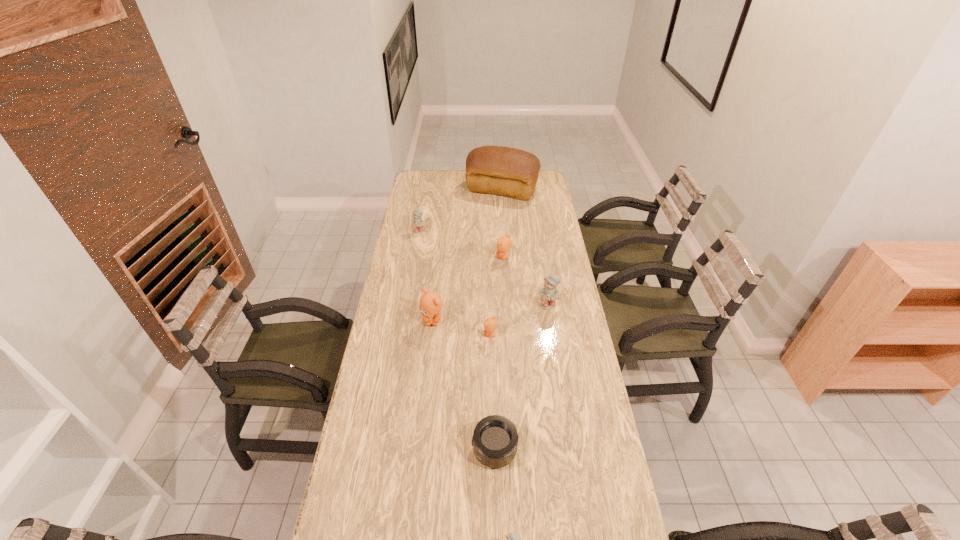
At what (x,y) coordinates should I click in order to perform the action: click on vacant position located on the face of the second brown teddy bear from left to right. Please return your answer as a coordinate pair (x, y). The width and height of the screenshot is (960, 540). Looking at the image, I should click on (444, 335).

Image resolution: width=960 pixels, height=540 pixels. Find the location of `free space located on the face of the second brown teddy bear from left to right`. free space located on the face of the second brown teddy bear from left to right is located at coordinates (427, 335).

Where is `vacant space located 0.340m on the face of the second brown teddy bear from left to right`? The height and width of the screenshot is (540, 960). vacant space located 0.340m on the face of the second brown teddy bear from left to right is located at coordinates click(392, 335).

Find the location of a particular element. vacant region located 0.240m on the side of the second nearest object with brand markings and control switches is located at coordinates (391, 450).

This screenshot has height=540, width=960. In order to click on vacant space situated 0.180m on the side of the second nearest object with brand markings and control switches in this screenshot , I will do `click(411, 450)`.

You are a GUI agent. You are given a task and a screenshot of the screen. Output one action in this format:
    pyautogui.click(x=<x>, y=<y>)
    Task: Click on the vacant area located on the side of the second nearest object with brand markings and control switches
    The height and width of the screenshot is (540, 960).
    Given the screenshot: What is the action you would take?
    pyautogui.click(x=408, y=450)

Find the location of a particular element. The width and height of the screenshot is (960, 540). object located at the far edge is located at coordinates (511, 172).

Locate an element on the screen. bread situated at the right edge is located at coordinates (511, 172).

Identify the location of teddy bear present at the right edge. The width and height of the screenshot is (960, 540). tap(548, 294).

Locate an element on the screen. object situated at the far right corner is located at coordinates 511,172.